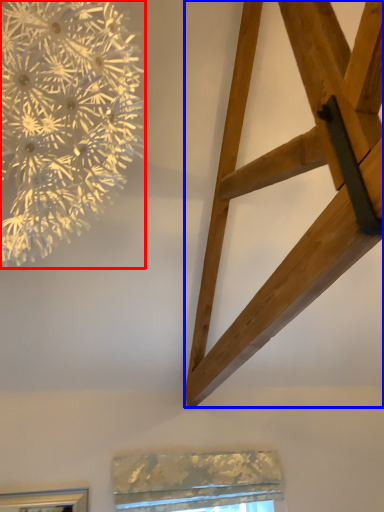
Question: Which of the following is the farthest to the observer, flower (highlighted by a red box) or furniture (highlighted by a blue box)?

Choices:
 (A) flower
 (B) furniture

Answer: (B)